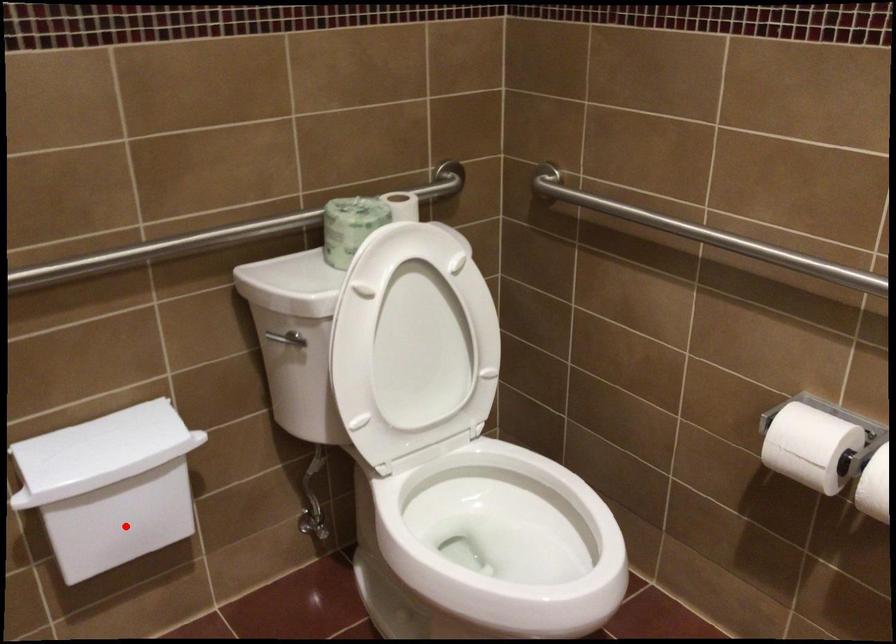
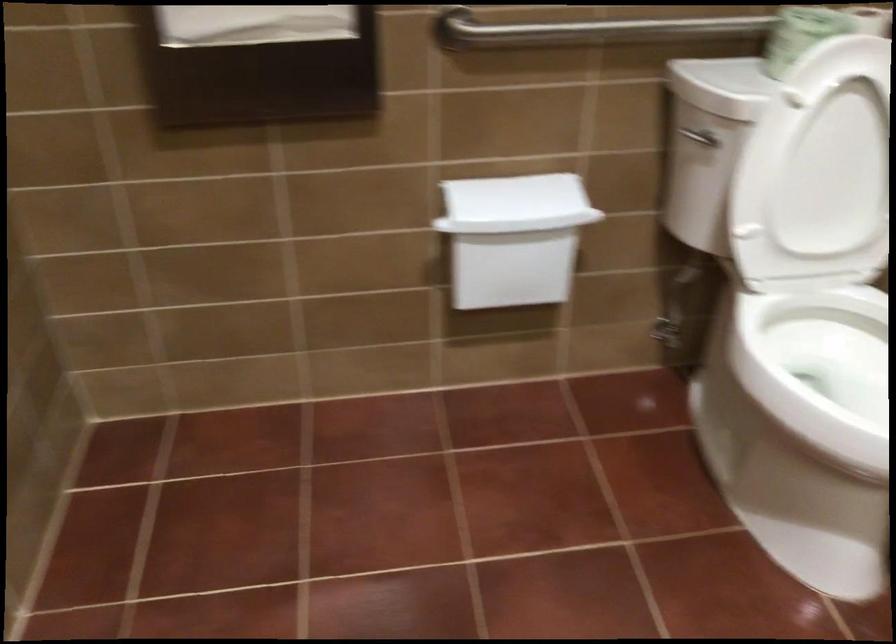
Question: I am providing you with two images of the same scene from different viewpoints. Given a red point in image1, look at the same physical point in image2. Is it:

Choices:
 (A) Closer to the viewpoint
 (B) Farther from the viewpoint

Answer: (B)